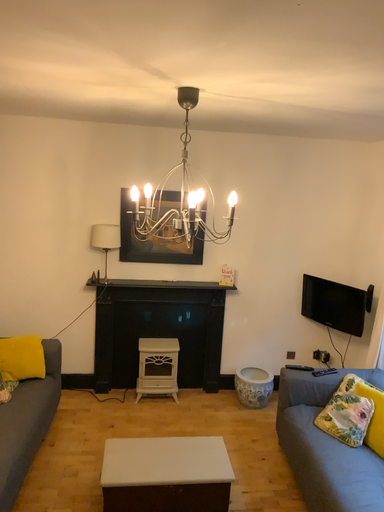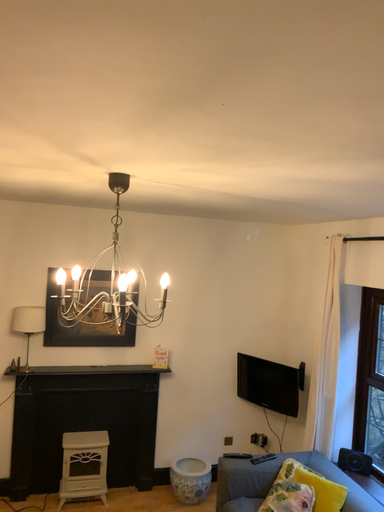
Question: How did the camera likely rotate when shooting the video?

Choices:
 (A) rotated upward
 (B) rotated downward

Answer: (A)